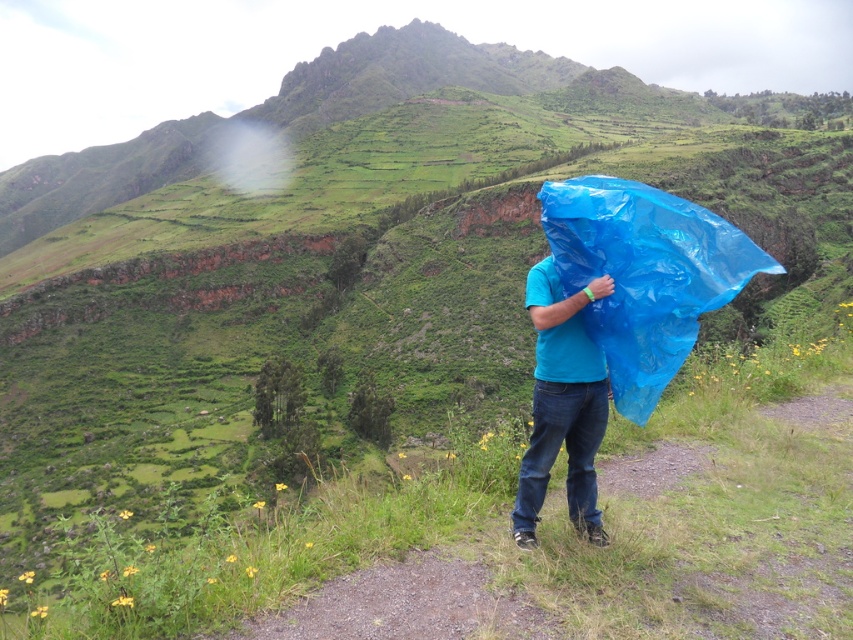
Which of these two, blue plastic bag at center or blue matte plastic bag at center, stands shorter?

blue plastic bag at center is shorter.

Who is taller, blue plastic bag at center or blue matte plastic bag at center?

blue matte plastic bag at center is taller.

Is point (590, 208) farther from viewer compared to point (595, 406)?

No, it is in front of (595, 406).

This screenshot has width=853, height=640. I want to click on blue plastic bag at center, so click(643, 275).